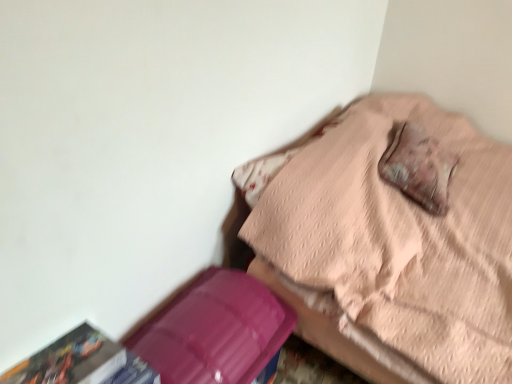
The height and width of the screenshot is (384, 512). Find the location of `free space above purple plastic box at lower left (from a real-world perspective)`. free space above purple plastic box at lower left (from a real-world perspective) is located at coordinates (197, 324).